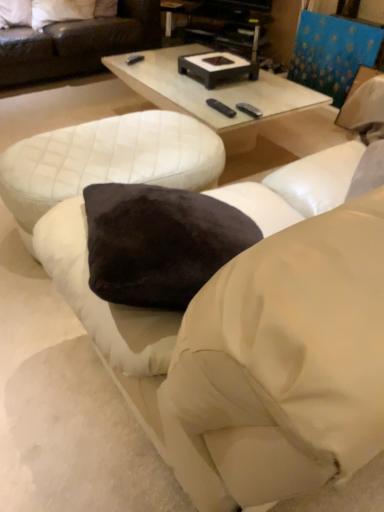
Find the location of a particular element. black plastic entertainment center at upper center is located at coordinates (220, 23).

What do you see at coordinates (233, 102) in the screenshot? I see `white glossy coffee table at center` at bounding box center [233, 102].

Image resolution: width=384 pixels, height=512 pixels. Describe the element at coordinates (77, 44) in the screenshot. I see `black leather couch at upper left` at that location.

At what (x,y) coordinates should I click in order to perform the action: click on black plastic entertainment center at upper center. Please return your answer as a coordinate pair (x, y). Image resolution: width=384 pixels, height=512 pixels. Looking at the image, I should click on (220, 23).

Is velvet dark brown pillow at upper left, placed as the 1th pillow when sorted from left to right, not inside white soft pillow at upper left, the 2th pillow in the left-to-right sequence?

Yes, velvet dark brown pillow at upper left, placed as the 1th pillow when sorted from left to right, is not within white soft pillow at upper left, the 2th pillow in the left-to-right sequence.

In the image, is velvet dark brown pillow at upper left, placed as the 1th pillow when sorted from left to right, positioned in front of or behind white soft pillow at upper left, which appears as the 1th pillow when viewed from the right?

In the image, velvet dark brown pillow at upper left, placed as the 1th pillow when sorted from left to right, appears in front of white soft pillow at upper left, which appears as the 1th pillow when viewed from the right.

Does velvet dark brown pillow at upper left, placed as the 1th pillow when sorted from left to right, turn towards white soft pillow at upper left, the 2th pillow in the left-to-right sequence?

No, velvet dark brown pillow at upper left, placed as the 1th pillow when sorted from left to right, does not turn towards white soft pillow at upper left, the 2th pillow in the left-to-right sequence.

Is white soft pillow at upper left, which appears as the 1th pillow when viewed from the right, in contact with velvet dark brown pillow at upper left, placed as the 1th pillow when sorted from left to right?

No, white soft pillow at upper left, which appears as the 1th pillow when viewed from the right, is not with velvet dark brown pillow at upper left, placed as the 1th pillow when sorted from left to right.

Is velvet dark brown pillow at upper left, the 2th pillow in the right-to-left sequence, at the back of white soft pillow at upper left, which appears as the 1th pillow when viewed from the right?

No, velvet dark brown pillow at upper left, the 2th pillow in the right-to-left sequence, is not at the back of white soft pillow at upper left, which appears as the 1th pillow when viewed from the right.

Which object is closer to the camera taking this photo, white soft pillow at upper left, which appears as the 1th pillow when viewed from the right, or velvet dark brown pillow at upper left, placed as the 1th pillow when sorted from left to right?

velvet dark brown pillow at upper left, placed as the 1th pillow when sorted from left to right, is more forward.

Consider the image. Is white quilted ottoman at lower left completely or partially outside of black leather couch at upper left?

Indeed, white quilted ottoman at lower left is completely outside black leather couch at upper left.

This screenshot has width=384, height=512. I want to click on table below the black leather couch at upper left (from the image's perspective), so click(107, 161).

Does white quilted ottoman at lower left turn towards black leather couch at upper left?

Yes, white quilted ottoman at lower left faces towards black leather couch at upper left.

Is velvet dark brown pillow at upper left, placed as the 1th pillow when sorted from left to right, placed right next to white quilted ottoman at lower left?

They are not placed beside each other.

From the image's perspective, which is above, velvet dark brown pillow at upper left, the 2th pillow in the right-to-left sequence, or white quilted ottoman at lower left?

velvet dark brown pillow at upper left, the 2th pillow in the right-to-left sequence.

Is velvet dark brown pillow at upper left, the 2th pillow in the right-to-left sequence, at the left side of white quilted ottoman at lower left?

Indeed, velvet dark brown pillow at upper left, the 2th pillow in the right-to-left sequence, is positioned on the left side of white quilted ottoman at lower left.

Is velvet dark brown pillow at upper left, the 2th pillow in the right-to-left sequence, facing towards white quilted ottoman at lower left?

Yes, velvet dark brown pillow at upper left, the 2th pillow in the right-to-left sequence, is oriented towards white quilted ottoman at lower left.

Which object is further away from the camera, velvet dark brown pillow at upper left, placed as the 1th pillow when sorted from left to right, or white glossy coffee table at center?

velvet dark brown pillow at upper left, placed as the 1th pillow when sorted from left to right, is behind.

From a real-world perspective, is velvet dark brown pillow at upper left, the 2th pillow in the right-to-left sequence, below white glossy coffee table at center?

No, from a real-world perspective, velvet dark brown pillow at upper left, the 2th pillow in the right-to-left sequence, is not beneath white glossy coffee table at center.

Is white glossy coffee table at center a part of velvet dark brown pillow at upper left, placed as the 1th pillow when sorted from left to right?

Definitely not — white glossy coffee table at center is not inside velvet dark brown pillow at upper left, placed as the 1th pillow when sorted from left to right.

From the image's perspective, would you say white soft pillow at upper left, which appears as the 1th pillow when viewed from the right, is shown under black leather couch at upper left?

No, from the image's perspective, white soft pillow at upper left, which appears as the 1th pillow when viewed from the right, is not below black leather couch at upper left.

Can you tell me how much white soft pillow at upper left, which appears as the 1th pillow when viewed from the right, and black leather couch at upper left differ in facing direction?

The facing directions of white soft pillow at upper left, which appears as the 1th pillow when viewed from the right, and black leather couch at upper left are 1.76 degrees apart.

Between point (32, 5) and point (65, 74), which one is positioned in front?

The point (32, 5) is more forward.

Is white soft pillow at upper left, which appears as the 1th pillow when viewed from the right, inside the boundaries of black leather couch at upper left, or outside?

white soft pillow at upper left, which appears as the 1th pillow when viewed from the right, is spatially positioned inside black leather couch at upper left.

Is white glossy coffee table at center far away from black leather couch at upper left?

white glossy coffee table at center is positioned a significant distance from black leather couch at upper left.

Is white glossy coffee table at center wider or thinner than black leather couch at upper left?

Considering their sizes, white glossy coffee table at center looks slimmer than black leather couch at upper left.

Can you confirm if white glossy coffee table at center is positioned to the left of black leather couch at upper left?

No, white glossy coffee table at center is not to the left of black leather couch at upper left.

Is white glossy coffee table at center facing towards black leather couch at upper left?

No, white glossy coffee table at center is not facing towards black leather couch at upper left.

You are a GUI agent. You are given a task and a screenshot of the screen. Output one action in this format:
    pyautogui.click(x=<x>, y=<y>)
    Task: Click on the pillow located in front of the white soft pillow at upper left, which appears as the 1th pillow when viewed from the right
    The width and height of the screenshot is (384, 512).
    Given the screenshot: What is the action you would take?
    pyautogui.click(x=15, y=13)

Locate an element on the screen. The image size is (384, 512). pillow below the white soft pillow at upper left, which appears as the 1th pillow when viewed from the right (from the image's perspective) is located at coordinates (15, 13).

Which object lies nearer to the anchor point white soft pillow at upper left, which appears as the 1th pillow when viewed from the right, white glossy coffee table at center or black plastic entertainment center at upper center?

The object closer to white soft pillow at upper left, which appears as the 1th pillow when viewed from the right, is black plastic entertainment center at upper center.

When comparing their distances from white glossy coffee table at center, does white quilted ottoman at lower left or velvet dark brown pillow at upper left, the 2th pillow in the right-to-left sequence, seem further?

The object further to white glossy coffee table at center is velvet dark brown pillow at upper left, the 2th pillow in the right-to-left sequence.

When comparing their distances from black plastic entertainment center at upper center, does velvet dark brown pillow at upper left, the 2th pillow in the right-to-left sequence, or white glossy coffee table at center seem further?

Result: velvet dark brown pillow at upper left, the 2th pillow in the right-to-left sequence, is further to black plastic entertainment center at upper center.

When comparing their distances from white glossy coffee table at center, does white soft pillow at upper left, which appears as the 1th pillow when viewed from the right, or black plastic entertainment center at upper center seem closer?

black plastic entertainment center at upper center is closer to white glossy coffee table at center.

Looking at the image, which one is located closer to velvet dark brown pillow at upper left, the 2th pillow in the right-to-left sequence, black plastic entertainment center at upper center or black leather couch at upper left?

black leather couch at upper left.

Which object lies nearer to the anchor point black plastic entertainment center at upper center, velvet dark brown pillow at upper left, placed as the 1th pillow when sorted from left to right, or white soft pillow at upper left, the 2th pillow in the left-to-right sequence?

white soft pillow at upper left, the 2th pillow in the left-to-right sequence, is closer to black plastic entertainment center at upper center.

When comparing their distances from velvet dark brown pillow at upper left, placed as the 1th pillow when sorted from left to right, does black plastic entertainment center at upper center or white soft pillow at upper left, which appears as the 1th pillow when viewed from the right, seem further?

Among the two, black plastic entertainment center at upper center is located further to velvet dark brown pillow at upper left, placed as the 1th pillow when sorted from left to right.

From the image, which object appears to be nearer to black plastic entertainment center at upper center, velvet dark brown pillow at upper left, placed as the 1th pillow when sorted from left to right, or white quilted ottoman at lower left?

velvet dark brown pillow at upper left, placed as the 1th pillow when sorted from left to right, is positioned closer to the anchor black plastic entertainment center at upper center.

Where is `studio couch located between velvet dark brown pillow at upper left, placed as the 1th pillow when sorted from left to right, and white glossy coffee table at center in the left-right direction`? Image resolution: width=384 pixels, height=512 pixels. studio couch located between velvet dark brown pillow at upper left, placed as the 1th pillow when sorted from left to right, and white glossy coffee table at center in the left-right direction is located at coordinates (77, 44).

Locate an element on the screen. The width and height of the screenshot is (384, 512). pillow between velvet dark brown pillow at upper left, placed as the 1th pillow when sorted from left to right, and black plastic entertainment center at upper center from left to right is located at coordinates (60, 11).

Find the location of a particular element. The image size is (384, 512). studio couch between white quilted ottoman at lower left and velvet dark brown pillow at upper left, the 2th pillow in the right-to-left sequence, in the front-back direction is located at coordinates (77, 44).

Image resolution: width=384 pixels, height=512 pixels. I want to click on studio couch located between velvet dark brown pillow at upper left, the 2th pillow in the right-to-left sequence, and black plastic entertainment center at upper center in the left-right direction, so click(x=77, y=44).